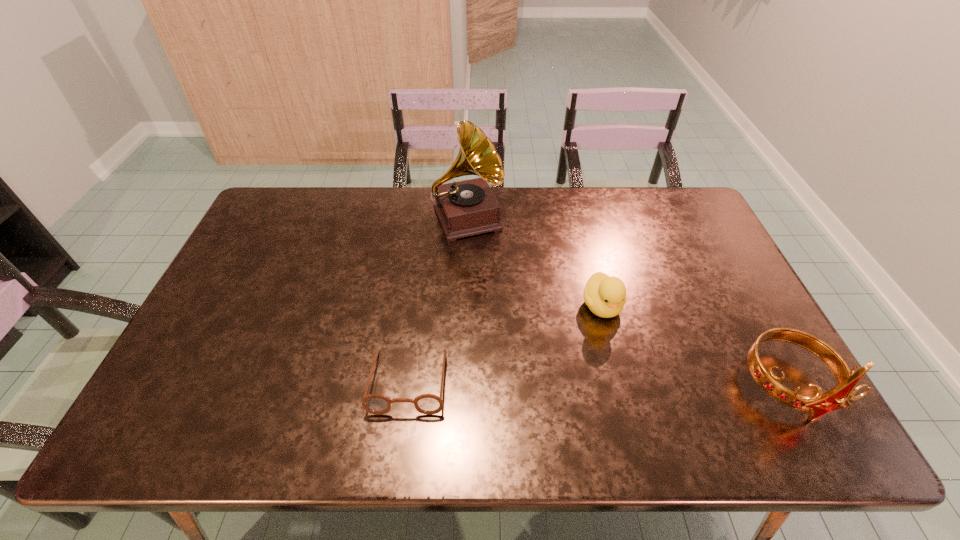
Where is `vacant space on the desktop that is between the spectacles and the tiara and is positioned from the horn of the farthest object`? This screenshot has height=540, width=960. vacant space on the desktop that is between the spectacles and the tiara and is positioned from the horn of the farthest object is located at coordinates (546, 383).

The image size is (960, 540). Identify the location of vacant space on the desktop that is between the spectacles and the tiara and is positioned on the front-facing side of the second farthest object. (640, 384).